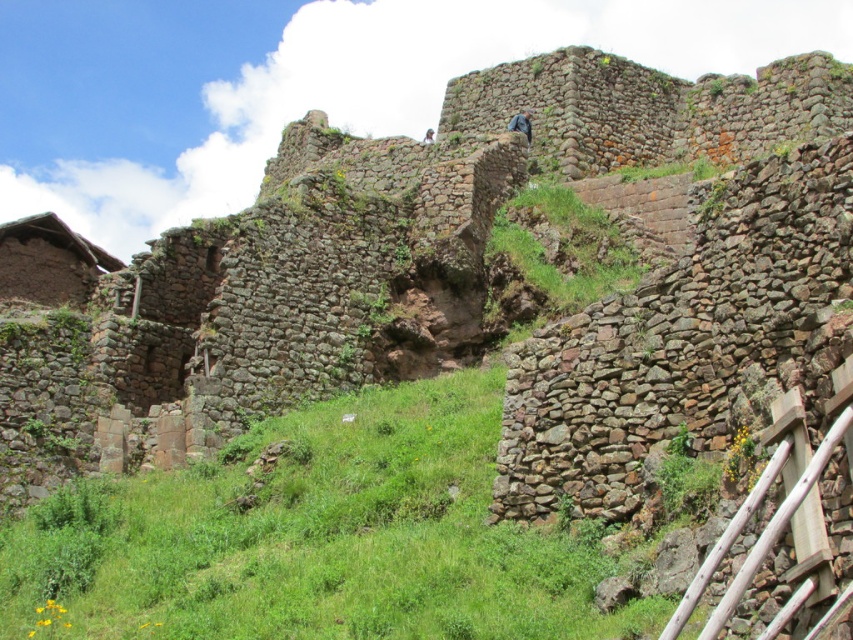
You are a photographer planning to capture a landscape shot of the ancient stone architecture. You notice the green grassy at center and the blue fabric at upper center. Which object will appear closer to the camera in the photo?

The green grassy at center appears closer to the camera because it is taller than the blue fabric at upper center, creating a sense of depth in the image.

You are a drone operator trying to capture aerial footage of the ancient stone architecture. Your drone is currently hovering at a height of 30 meters above the green grassy at center. Can you safely descend to 20 meters without hitting any obstacles?

The distance between the green grassy at center and the camera is 32.87 meters. Since the drone is hovering at 30 meters above the green grassy at center, descending to 20 meters would still keep it 12.87 meters above the grassy area, which is safe from obstacles.

You are standing at the base of the ancient stone structure and want to reach the highest point. You notice two points marked on the slope. According to the image, which point is closer to the top of the structure? The points are labeled as point (x=517, y=115) and point (x=430, y=134).

A: Point (x=517, y=115) is behind point (x=430, y=134), so it is closer to the top of the structure.